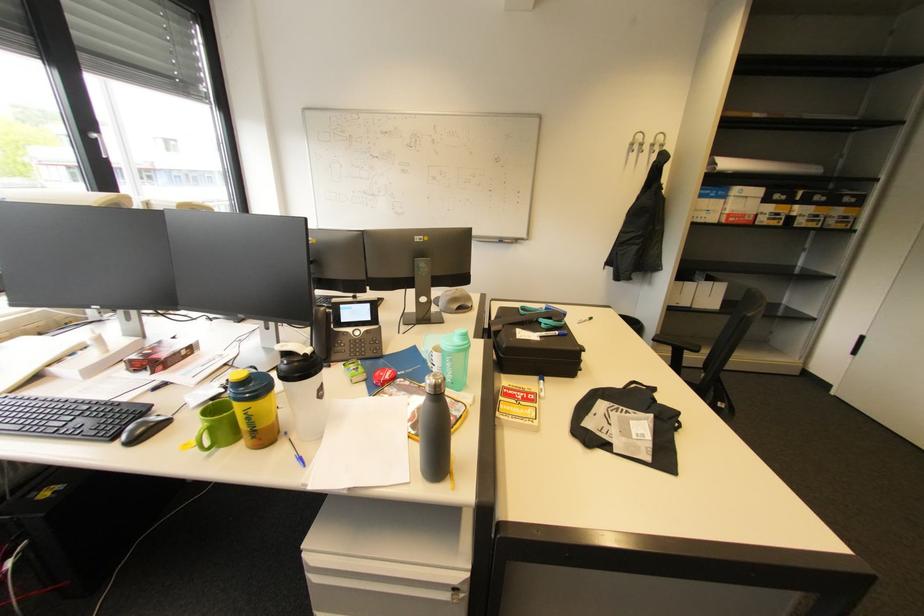
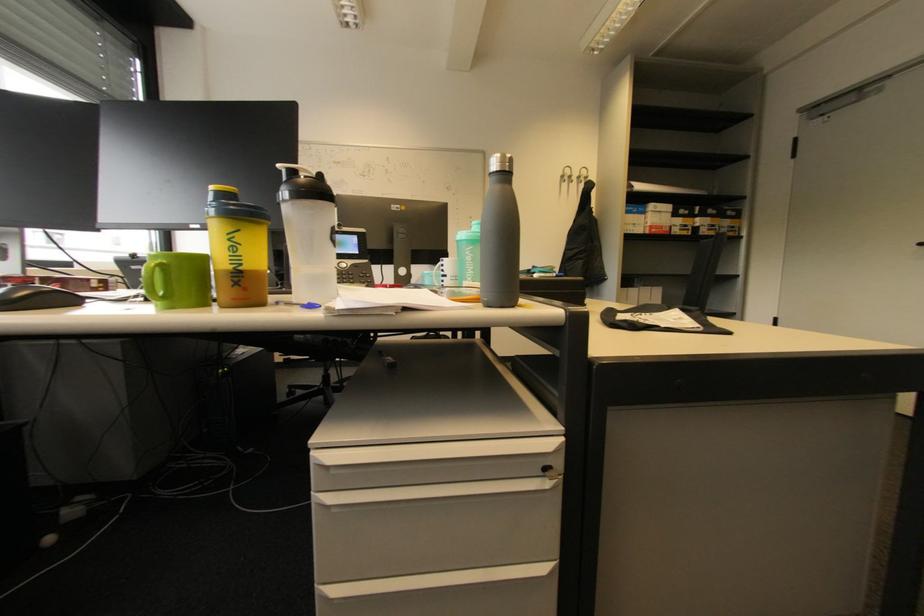
In the second image, find the point that corresponds to (453,361) in the first image.

(472, 254)